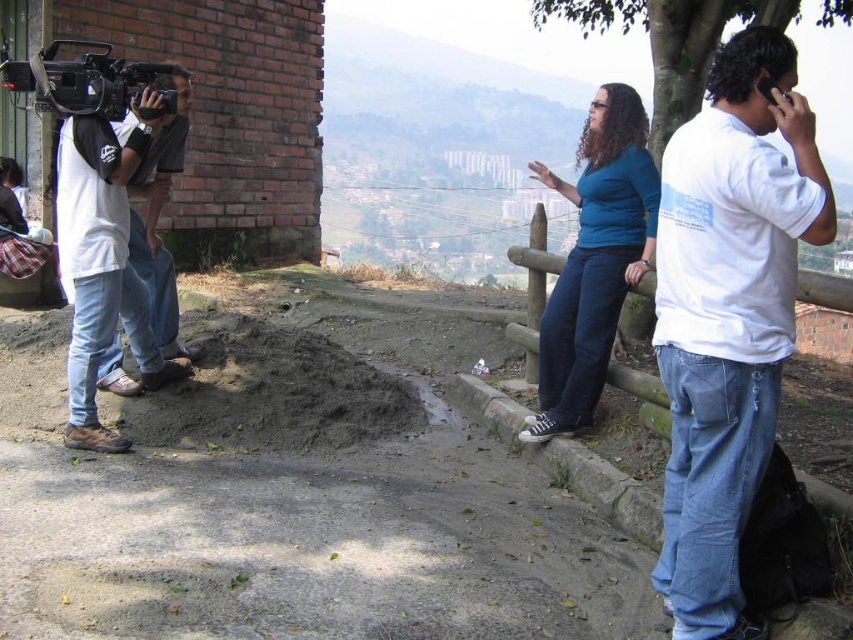
Question: Among these points, which one is nearest to the camera?

Choices:
 (A) (787, 92)
 (B) (183, 131)
 (C) (108, 244)
 (D) (48, 81)

Answer: (A)

Question: Does white cotton shirt at right have a smaller size compared to matte black camera at left?

Choices:
 (A) yes
 (B) no

Answer: (B)

Question: Is matte black camera at left closer to camera compared to black plastic phone at upper right?

Choices:
 (A) no
 (B) yes

Answer: (A)

Question: Which point appears farthest from the camera in this image?

Choices:
 (A) (788, 99)
 (B) (791, 148)

Answer: (A)

Question: Which point appears farthest from the camera in this image?

Choices:
 (A) (186, 355)
 (B) (157, 92)
 (C) (665, 518)
 (D) (84, 157)

Answer: (A)

Question: Does brown leather boots at left appear over black plastic phone at upper right?

Choices:
 (A) yes
 (B) no

Answer: (B)